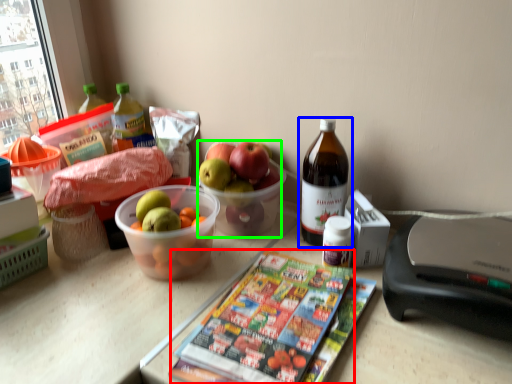
Question: Based on their relative distances, which object is farther from magazine (highlighted by a red box)? Choose from bottle (highlighted by a blue box) and grapefruit (highlighted by a green box).

Choices:
 (A) bottle
 (B) grapefruit

Answer: (B)